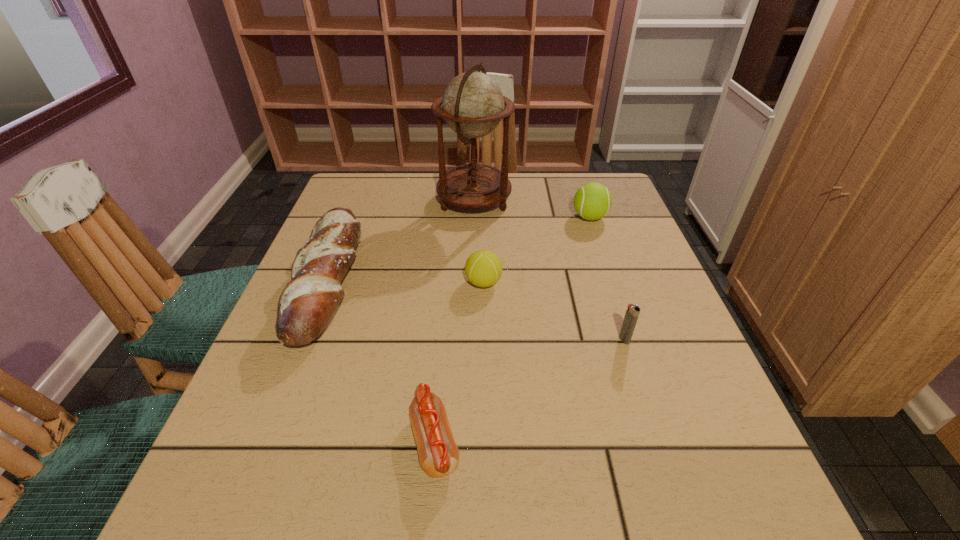
Locate an element on the screen. This screenshot has height=540, width=960. vacant space that satisfies the following two spatial constraints: 1. on the surface of the left tennis ball; 2. on the right side of the globe is located at coordinates (472, 282).

Where is `vacant region that satisfies the following two spatial constraints: 1. on the front side of the igniter; 2. on the left side of the left tennis ball`? vacant region that satisfies the following two spatial constraints: 1. on the front side of the igniter; 2. on the left side of the left tennis ball is located at coordinates (484, 340).